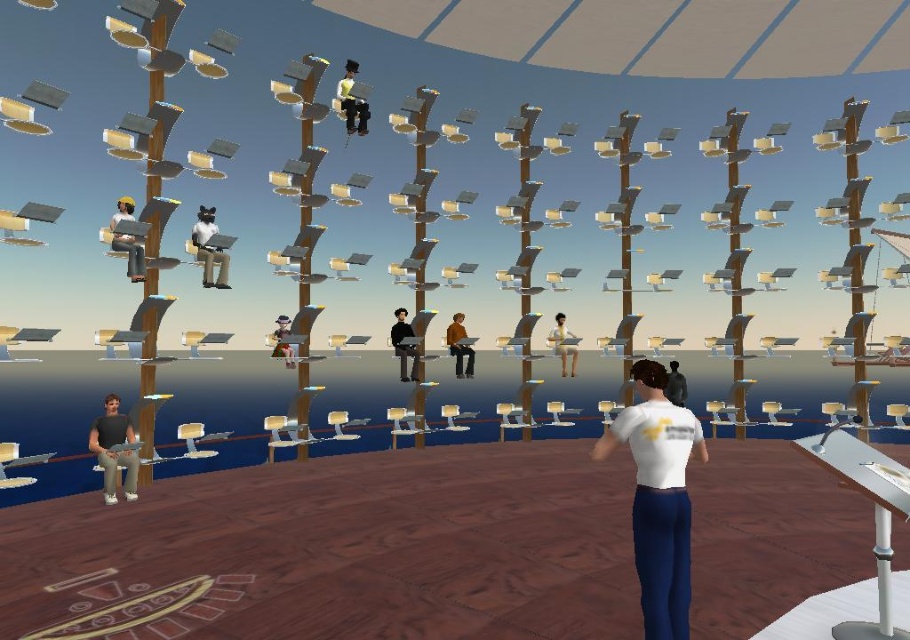
Is point (604, 458) in front of point (191, 228)?

Yes, point (604, 458) is in front of point (191, 228).

Which is behind, point (635, 531) or point (228, 280)?

The point (228, 280) is more distant.

The height and width of the screenshot is (640, 910). I want to click on white matte shirt at lower right, so click(x=658, y=497).

Which is above, white matte shirt at lower right or dark gray shirt at lower left?

Positioned higher is white matte shirt at lower right.

Consider the image. Which is below, white matte shirt at lower right or dark gray shirt at lower left?

dark gray shirt at lower left is below.

Between point (634, 545) and point (132, 429), which one is positioned behind?

Positioned behind is point (132, 429).

Locate an element on the screen. The height and width of the screenshot is (640, 910). white matte shirt at lower right is located at coordinates (658, 497).

Can you confirm if white matte shirt at lower right is bigger than light brown wooden chair at center?

No.

Is white matte shirt at lower right above light brown wooden chair at center?

No.

At what (x,y) coordinates should I click in order to perform the action: click on white matte shirt at lower right. Please return your answer as a coordinate pair (x, y). Looking at the image, I should click on (658, 497).